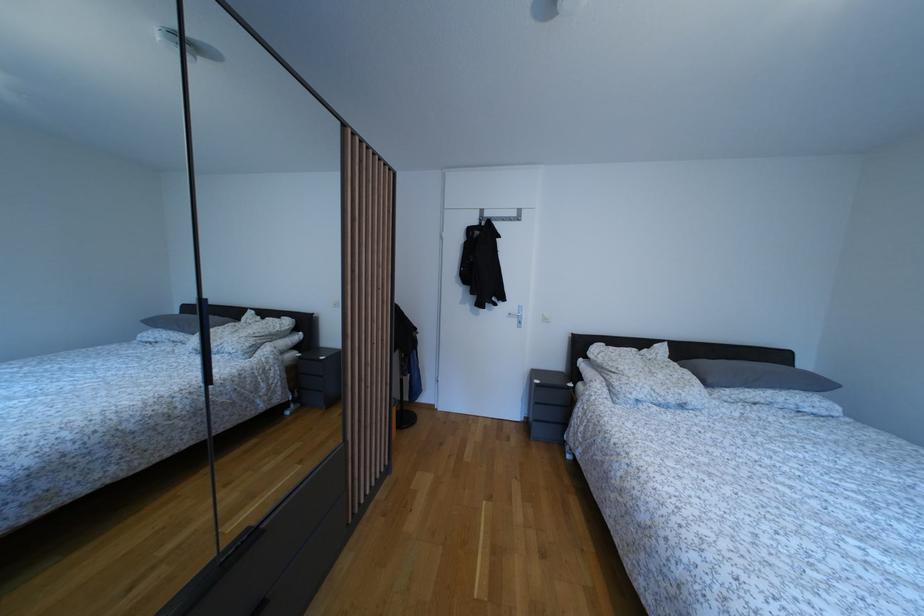
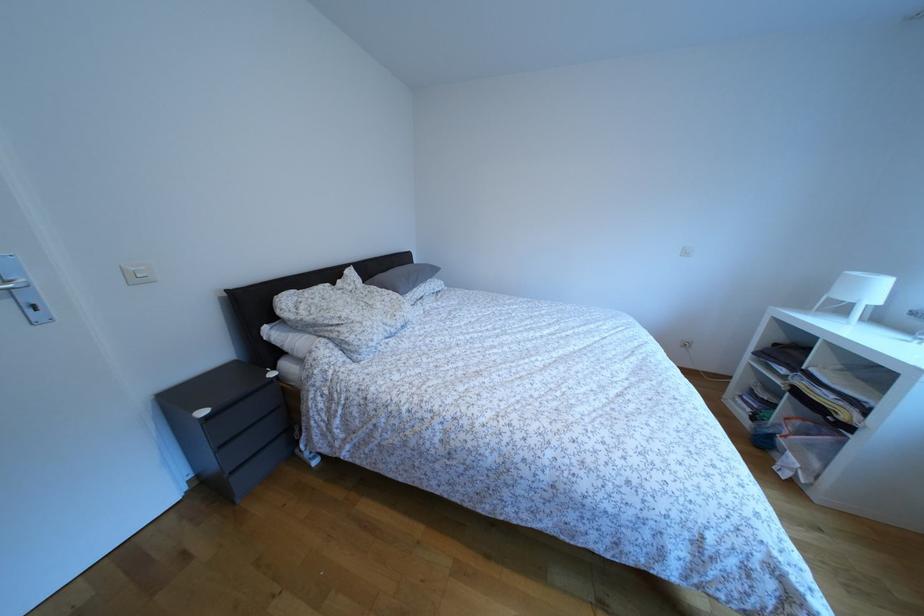
Looking at this image, first-person continuous shooting, in which direction is the camera rotating?

The camera rotated toward right-down.